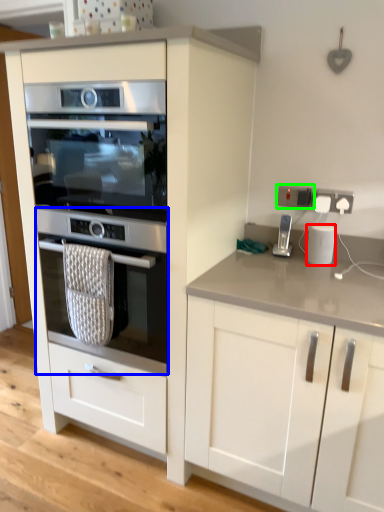
Question: Which is nearer to the kitchen appliance (highlighted by a red box)? oven (highlighted by a blue box) or electric outlet (highlighted by a green box).

Choices:
 (A) oven
 (B) electric outlet

Answer: (B)